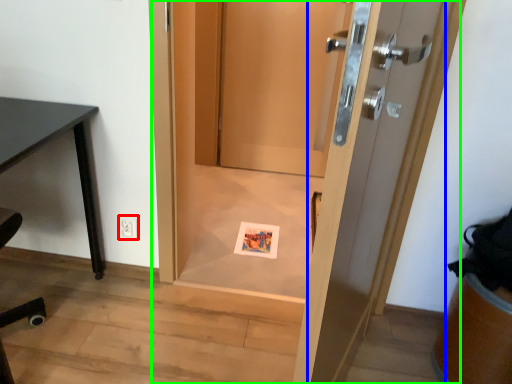
Question: Based on their relative distances, which object is farther from electric outlet (highlighted by a red box)? Choose from door (highlighted by a blue box) and door (highlighted by a green box).

Choices:
 (A) door
 (B) door

Answer: (A)